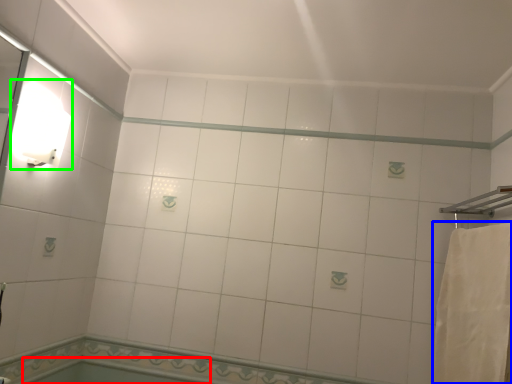
Question: Estimate the real-world distances between objects in this image. Which object is farther from bath (highlighted by a red box), bath towel (highlighted by a blue box) or light fixture (highlighted by a green box)?

Choices:
 (A) bath towel
 (B) light fixture

Answer: (A)